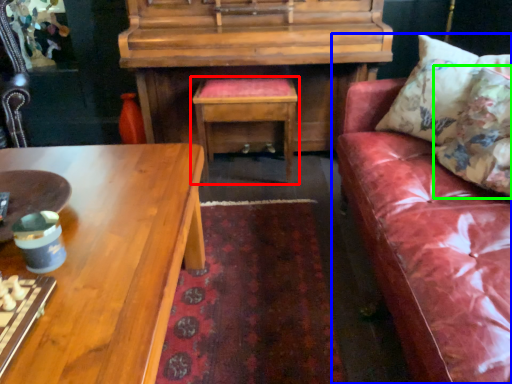
Question: Considering the real-world distances, which object is farthest from table (highlighted by a red box)? studio couch (highlighted by a blue box) or pillow (highlighted by a green box)?

Choices:
 (A) studio couch
 (B) pillow

Answer: (B)